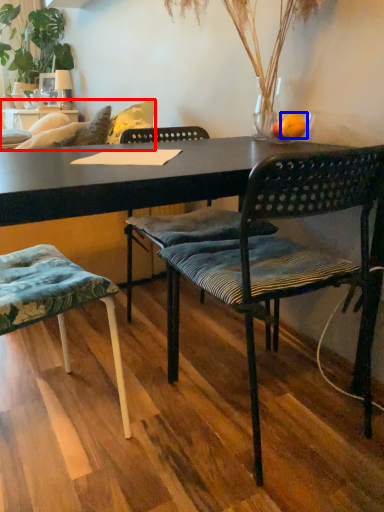
Question: Which object is closer to the camera taking this photo, studio couch (highlighted by a red box) or orange (highlighted by a blue box)?

Choices:
 (A) studio couch
 (B) orange

Answer: (B)